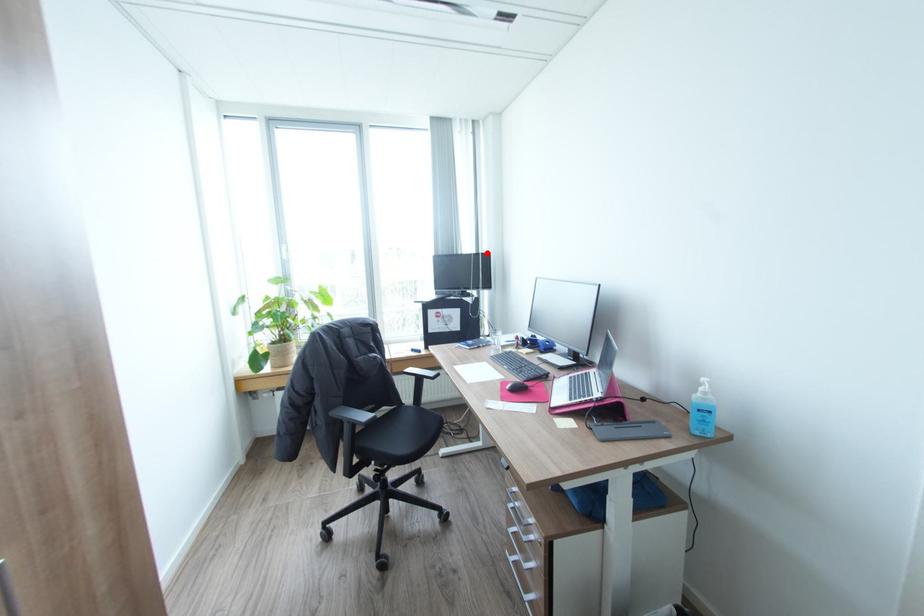
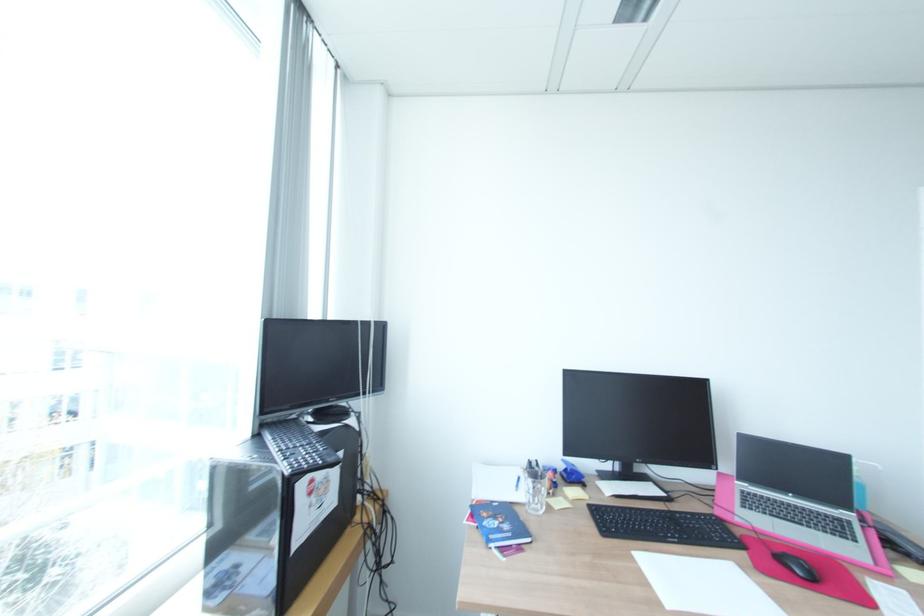
Where in the second image is the point corresponding to the highlighted location from the first image?

(381, 321)